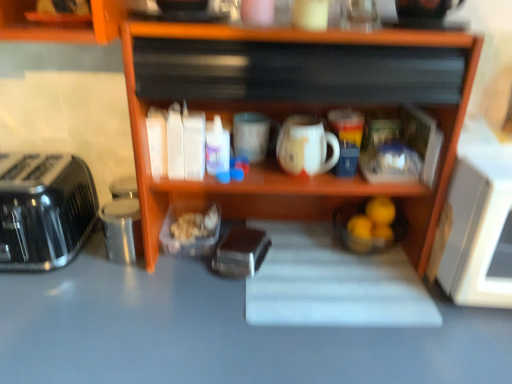
At what (x,y) coordinates should I click in order to perform the action: click on free spot to the right of satin black toaster at left. Please return your answer as a coordinate pair (x, y). Looking at the image, I should click on (119, 277).